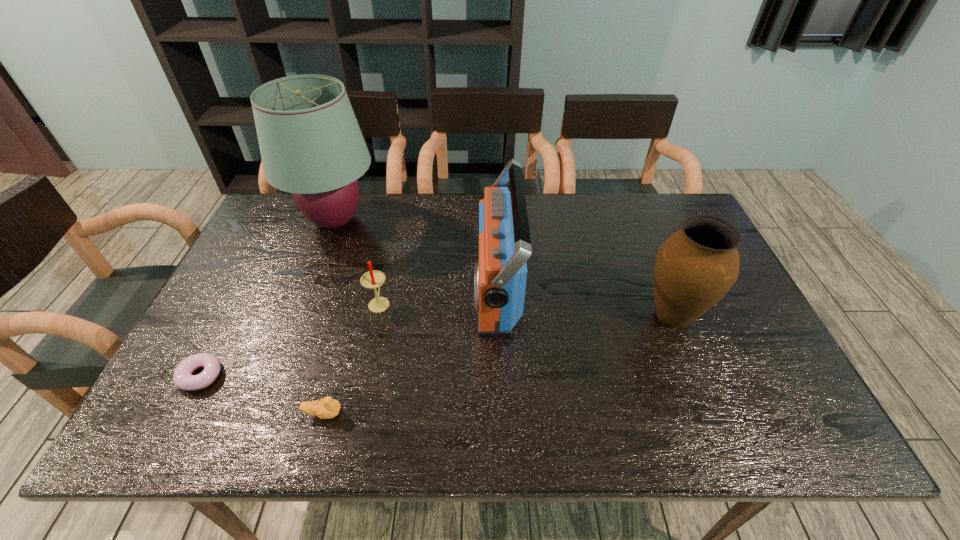
This screenshot has height=540, width=960. Find the location of `lampshade`. lampshade is located at coordinates (311, 145).

This screenshot has height=540, width=960. I want to click on the second object from right to left, so click(x=499, y=276).

What are the coordinates of `the rightmost object` in the screenshot? It's located at [x=696, y=266].

Where is `candle`? The image size is (960, 540). candle is located at coordinates (372, 279).

At what (x,y) coordinates should I click in order to perform the action: click on the fifth tallest object. Please return your answer as a coordinate pair (x, y). This screenshot has height=540, width=960. Looking at the image, I should click on (326, 408).

Image resolution: width=960 pixels, height=540 pixels. Identify the location of the nearest object. (326, 408).

This screenshot has width=960, height=540. I want to click on the shortest object, so click(183, 379).

The image size is (960, 540). I want to click on doughnut, so click(183, 379).

Find the location of a particular element. This screenshot has height=540, width=960. free space located on the front of the lampshade is located at coordinates (303, 304).

Where is `vacant space located on the front-facing side of the radio receiver`? The width and height of the screenshot is (960, 540). vacant space located on the front-facing side of the radio receiver is located at coordinates (401, 289).